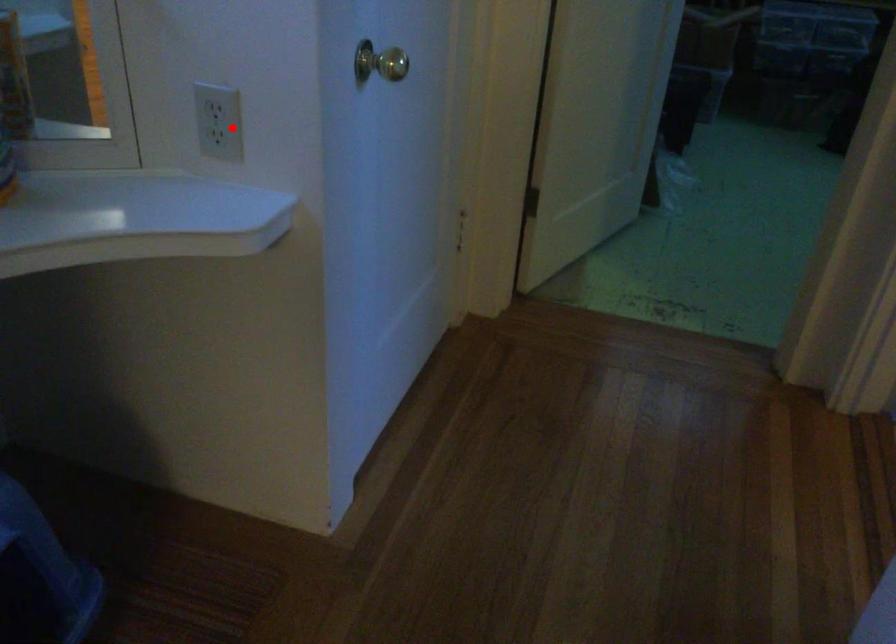
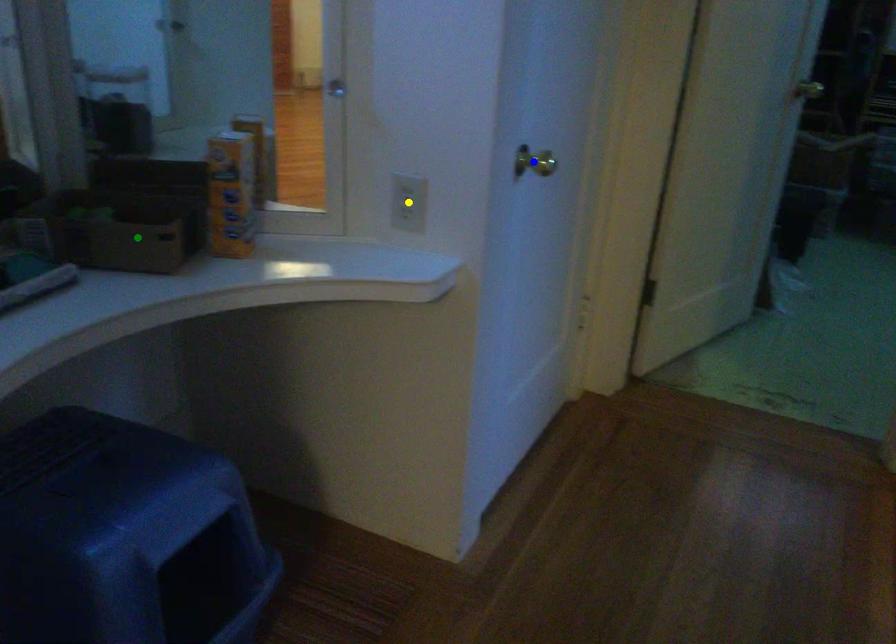
Question: I am providing you with two images of the same scene from different viewpoints. A red point is marked on the first image. You are given multiple points on the second image. Which spot in image 2 lines up with the point in image 1?

Choices:
 (A) blue point
 (B) yellow point
 (C) green point

Answer: (B)